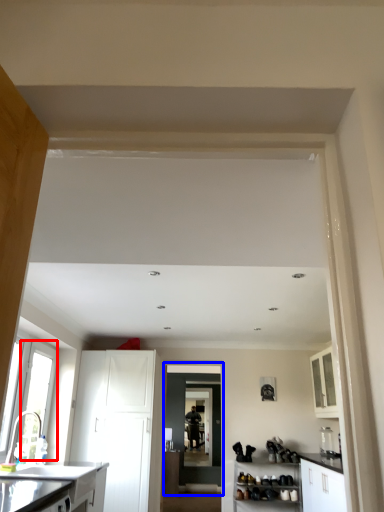
Question: Which point is closer to the camera, window (highlighted by a red box) or door (highlighted by a blue box)?

Choices:
 (A) window
 (B) door

Answer: (A)